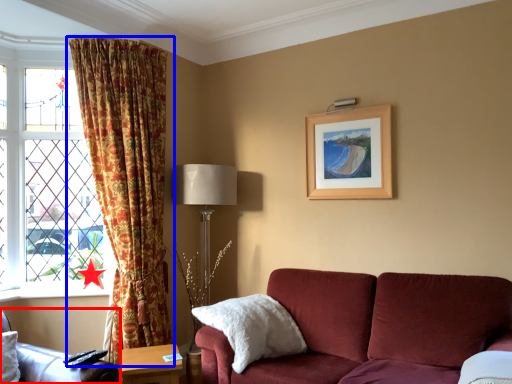
Question: Among these objects, which one is farthest to the camera, chair (highlighted by a red box) or curtain (highlighted by a blue box)?

Choices:
 (A) chair
 (B) curtain

Answer: (B)